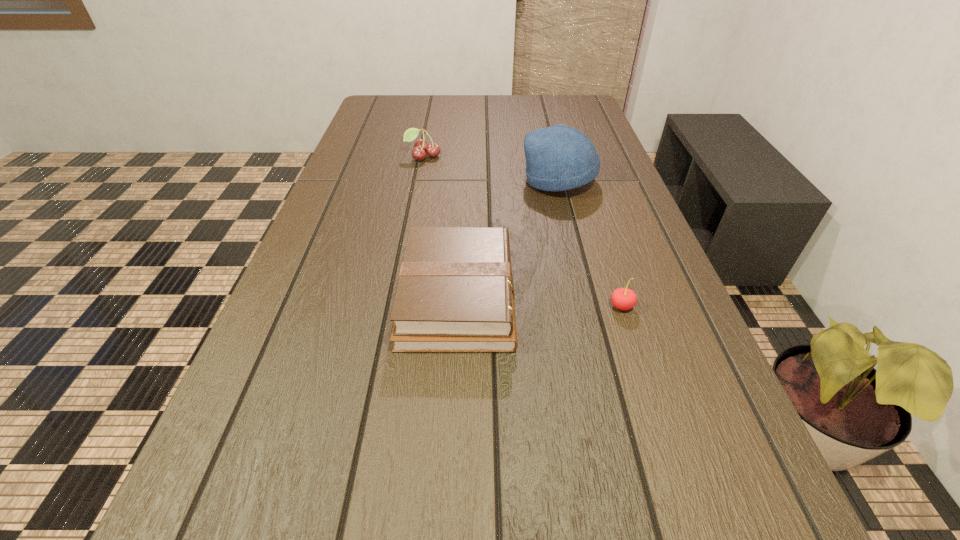
What are the coordinates of `object that is the third closest one to the Bible` in the screenshot? It's located at (421, 147).

Locate an element on the screen. object that ranks as the third closest to the Bible is located at coordinates pos(421,147).

Image resolution: width=960 pixels, height=540 pixels. Find the location of `vacant region that satisfies the following two spatial constraints: 1. on the spine side of the Bible; 2. on the right side of the right cherry`. vacant region that satisfies the following two spatial constraints: 1. on the spine side of the Bible; 2. on the right side of the right cherry is located at coordinates pyautogui.click(x=457, y=306).

Identify the location of free space that satisfies the following two spatial constraints: 1. on the spine side of the Bible; 2. on the left side of the nearer cherry. This screenshot has height=540, width=960. (457, 306).

The width and height of the screenshot is (960, 540). What are the coordinates of `vacant space that satisfies the following two spatial constraints: 1. on the leaves of the skullcap; 2. on the left side of the farther cherry` in the screenshot? It's located at (419, 181).

This screenshot has height=540, width=960. Find the location of `free space that satisfies the following two spatial constraints: 1. on the leaves of the left cherry; 2. on the right side of the nearer cherry`. free space that satisfies the following two spatial constraints: 1. on the leaves of the left cherry; 2. on the right side of the nearer cherry is located at coordinates (394, 306).

Image resolution: width=960 pixels, height=540 pixels. Identify the location of vacant position in the image that satisfies the following two spatial constraints: 1. on the spine side of the Bible; 2. on the left side of the nearer cherry. (457, 306).

At what (x,y) coordinates should I click in order to perform the action: click on free spot that satisfies the following two spatial constraints: 1. on the spine side of the Bible; 2. on the back side of the nearer cherry. Please return your answer as a coordinate pair (x, y). The height and width of the screenshot is (540, 960). Looking at the image, I should click on (457, 306).

Find the location of a particular element. The width and height of the screenshot is (960, 540). vacant area in the image that satisfies the following two spatial constraints: 1. on the leaves of the nearer cherry; 2. on the left side of the farther cherry is located at coordinates (394, 306).

This screenshot has width=960, height=540. What are the coordinates of `vacant space that satisfies the following two spatial constraints: 1. on the front side of the tallest object; 2. on the spine side of the Bible` in the screenshot? It's located at (588, 297).